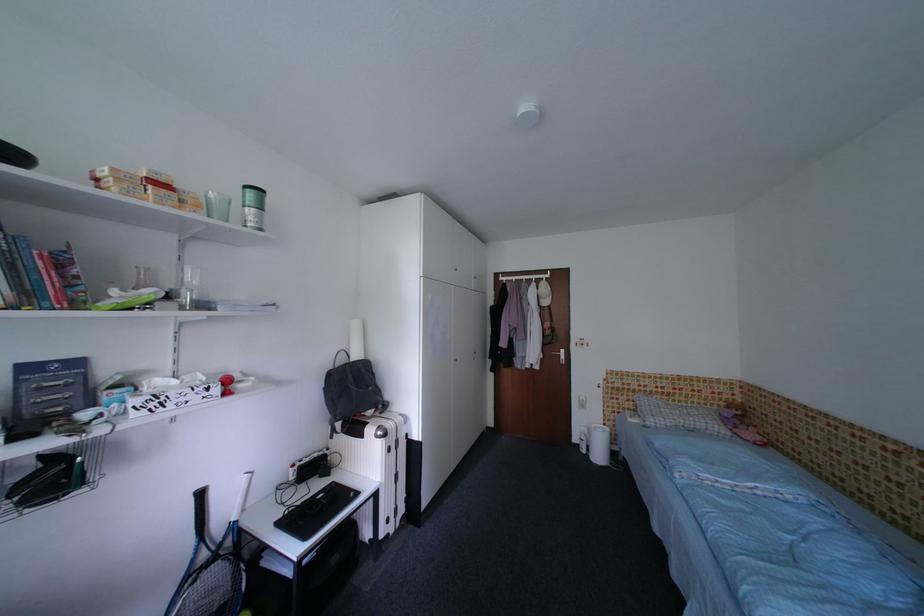
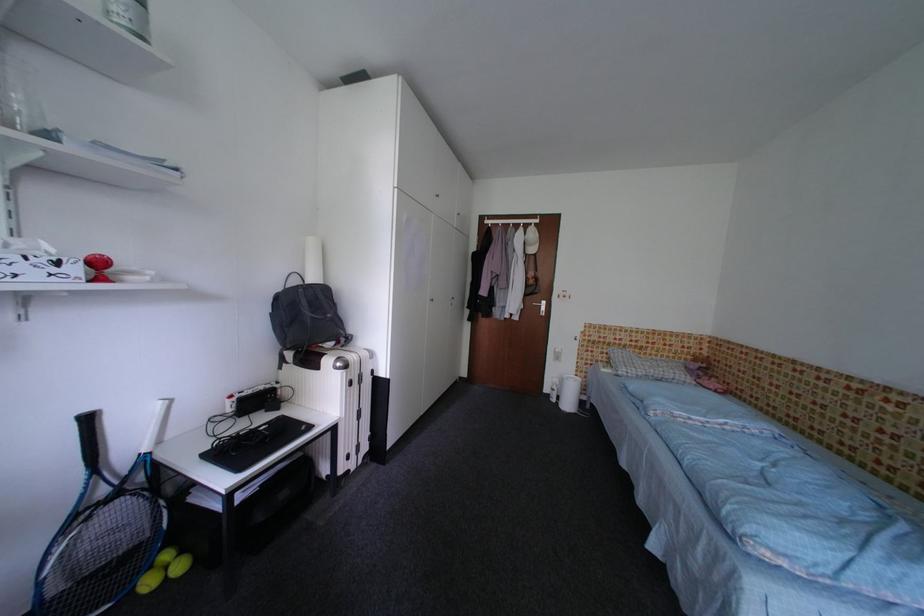
Locate, in the second image, the point that corresponds to (324,487) in the first image.

(270, 421)